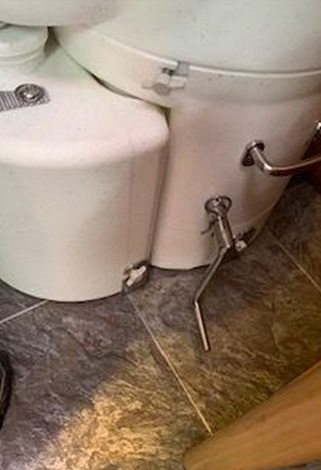
I want to click on toilet, so click(x=99, y=167), click(x=99, y=378).